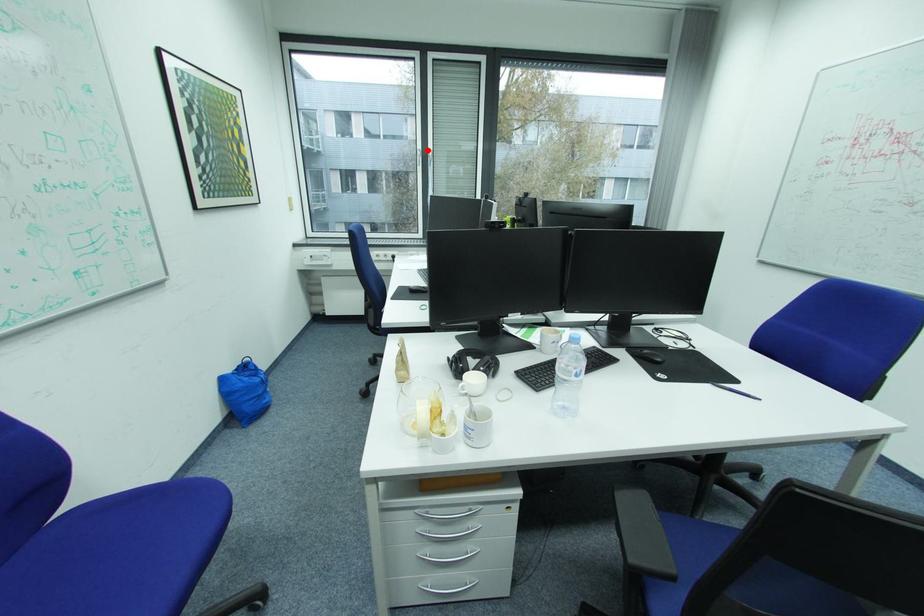
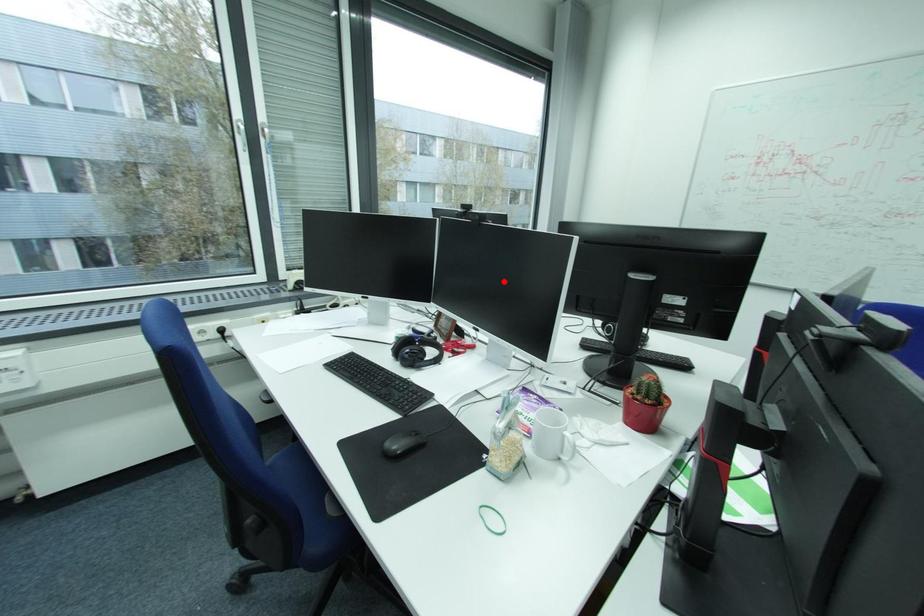
I am providing you with two images of the same scene from different viewpoints. A red point is marked on the first image and another point is marked on the second image. Does the point marked in image1 correspond to the same location as the one in image2?

No